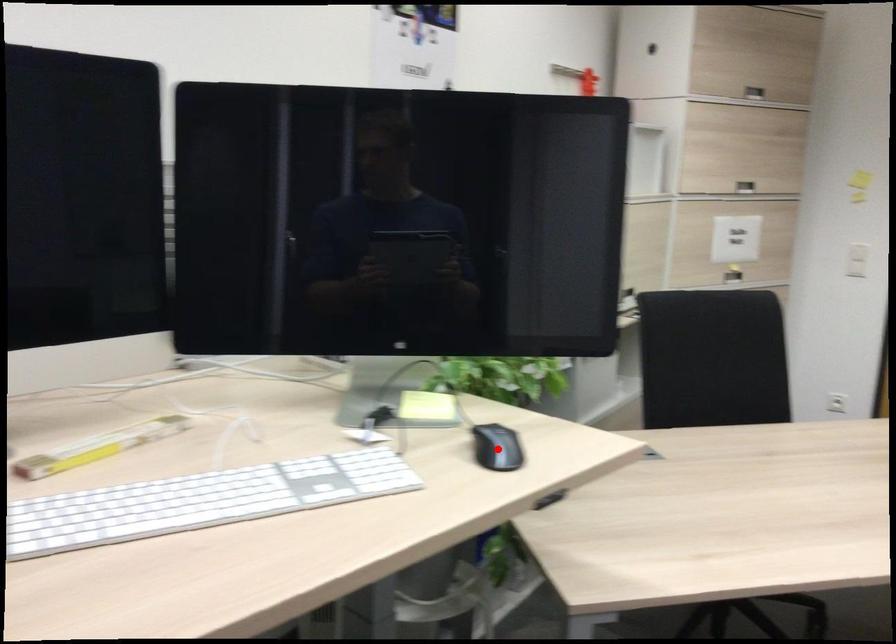
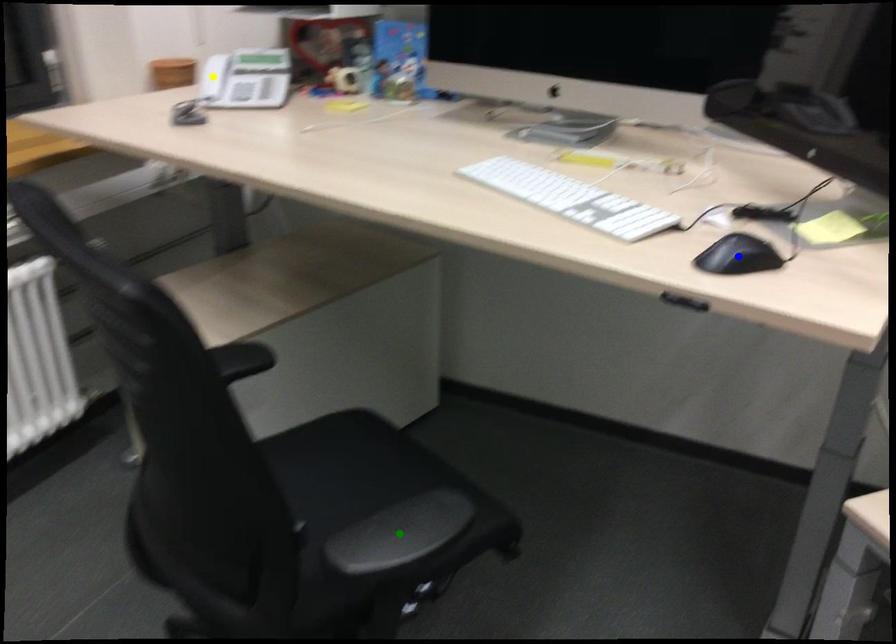
Question: I am providing you with two images of the same scene from different viewpoints. A red point is marked on the first image. You are given multiple points on the second image. Which spot in image 2 lines up with the point in image 1?

Choices:
 (A) yellow point
 (B) blue point
 (C) green point

Answer: (B)